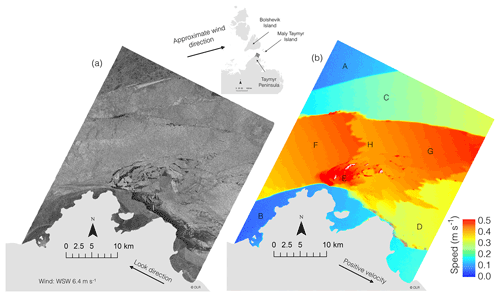
Identify the location of multi colored bar. (466, 221), (469, 230), (469, 237), (470, 244), (470, 251), (469, 265), (469, 272).